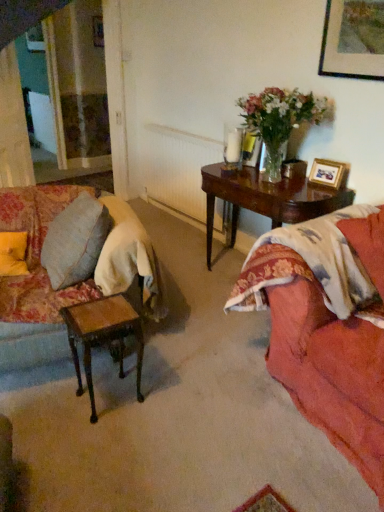
Question: Is light beige fabric curtain at left smaller than velvet floral couch at left?

Choices:
 (A) yes
 (B) no

Answer: (A)

Question: Can you see light beige fabric curtain at left touching velvet floral couch at left?

Choices:
 (A) no
 (B) yes

Answer: (A)

Question: Is light beige fabric curtain at left aimed at velvet floral couch at left?

Choices:
 (A) yes
 (B) no

Answer: (B)

Question: Is velvet floral couch at left located within light beige fabric curtain at left?

Choices:
 (A) no
 (B) yes

Answer: (A)

Question: Is light beige fabric curtain at left facing away from velvet floral couch at left?

Choices:
 (A) yes
 (B) no

Answer: (B)

Question: Considering their positions, is wooden picture frame at upper right located in front of or behind white textured radiator at center?

Choices:
 (A) front
 (B) behind

Answer: (A)

Question: In terms of width, does wooden picture frame at upper right look wider or thinner when compared to white textured radiator at center?

Choices:
 (A) thin
 (B) wide

Answer: (A)

Question: Based on their sizes in the image, would you say wooden picture frame at upper right is bigger or smaller than white textured radiator at center?

Choices:
 (A) big
 (B) small

Answer: (B)

Question: Would you say wooden picture frame at upper right is to the left or to the right of white textured radiator at center in the picture?

Choices:
 (A) right
 (B) left

Answer: (A)

Question: Is wooden picture frame at upper right to the left or to the right of light beige fabric curtain at left in the image?

Choices:
 (A) right
 (B) left

Answer: (A)

Question: Is point (332, 181) closer or farther from the camera than point (21, 115)?

Choices:
 (A) farther
 (B) closer

Answer: (B)

Question: From the image's perspective, is wooden picture frame at upper right located above or below light beige fabric curtain at left?

Choices:
 (A) above
 (B) below

Answer: (B)

Question: Based on their sizes in the image, would you say wooden picture frame at upper right is bigger or smaller than light beige fabric curtain at left?

Choices:
 (A) big
 (B) small

Answer: (B)

Question: In terms of size, does velvet floral couch at left appear bigger or smaller than white textured radiator at center?

Choices:
 (A) big
 (B) small

Answer: (A)

Question: Is velvet floral couch at left in front of or behind white textured radiator at center in the image?

Choices:
 (A) front
 (B) behind

Answer: (A)